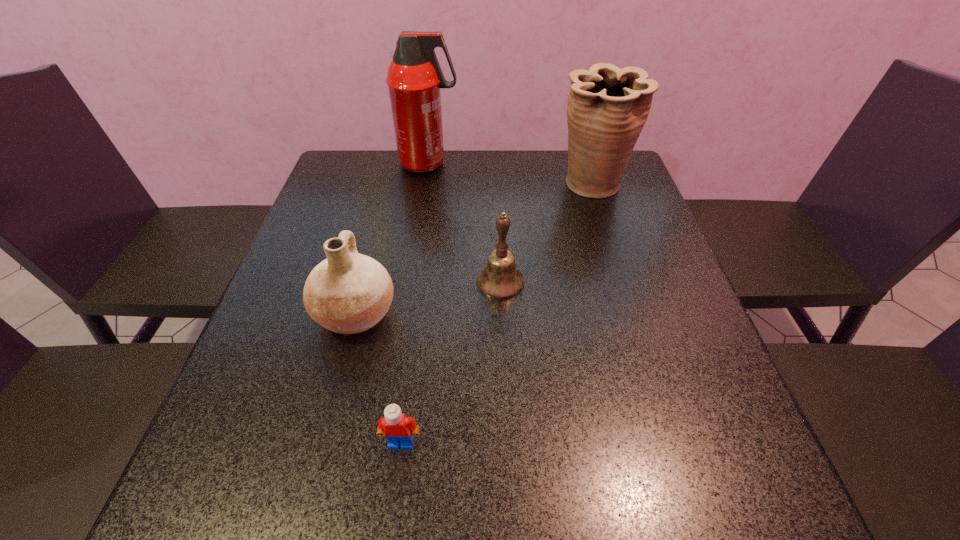
In order to click on vacant space situated on the left of the bell in this screenshot , I will do `click(333, 282)`.

The width and height of the screenshot is (960, 540). What are the coordinates of `free region located 0.050m on the face of the Lego` in the screenshot? It's located at (396, 482).

I want to click on fire extinguisher located in the far edge section of the desktop, so (x=414, y=78).

You are a GUI agent. You are given a task and a screenshot of the screen. Output one action in this format:
    pyautogui.click(x=<x>, y=<y>)
    Task: Click on the urn that is positioned at the far edge
    
    Given the screenshot: What is the action you would take?
    pyautogui.click(x=607, y=107)

Where is `object situated at the left edge`? The height and width of the screenshot is (540, 960). object situated at the left edge is located at coordinates (347, 293).

You are a GUI agent. You are given a task and a screenshot of the screen. Output one action in this format:
    pyautogui.click(x=<x>, y=<y>)
    Task: Click on the object at the right edge
    The height and width of the screenshot is (540, 960).
    Given the screenshot: What is the action you would take?
    pyautogui.click(x=607, y=107)

At what (x,y) coordinates should I click in order to perform the action: click on object that is at the far right corner. Please return your answer as a coordinate pair (x, y). Looking at the image, I should click on (607, 107).

You are a GUI agent. You are given a task and a screenshot of the screen. Output one action in this format:
    pyautogui.click(x=<x>, y=<y>)
    Task: Click on the free space at the far edge of the desktop
    
    Given the screenshot: What is the action you would take?
    pyautogui.click(x=488, y=193)

At what (x,y) coordinates should I click in order to perform the action: click on vacant area at the near edge of the desktop. Please return your answer as a coordinate pair (x, y). The width and height of the screenshot is (960, 540). Looking at the image, I should click on 468,495.

At what (x,y) coordinates should I click in order to perform the action: click on vacant space at the left edge of the desktop. Please return your answer as a coordinate pair (x, y). The image size is (960, 540). Looking at the image, I should click on [x=245, y=455].